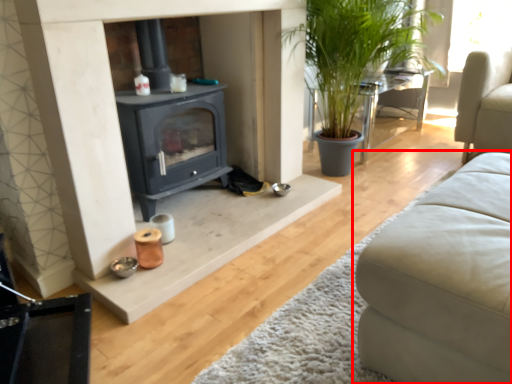
Question: Where is studio couch (annotated by the red box) located in relation to table in the image?

Choices:
 (A) right
 (B) left

Answer: (B)